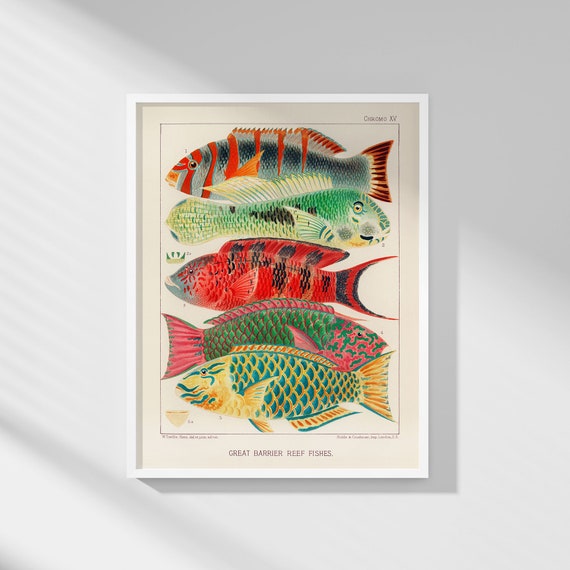
Where is `frame`? The height and width of the screenshot is (570, 570). frame is located at coordinates (422, 247).